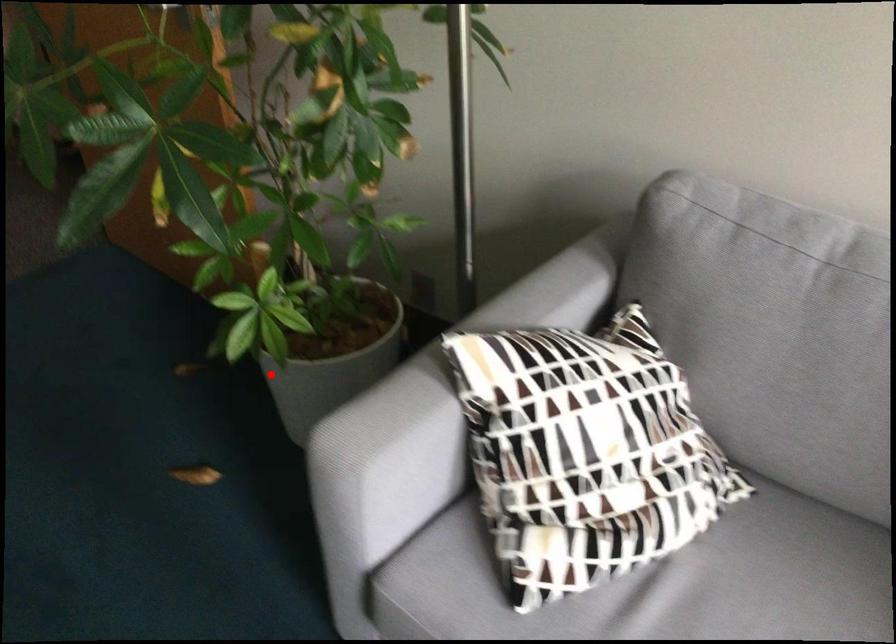
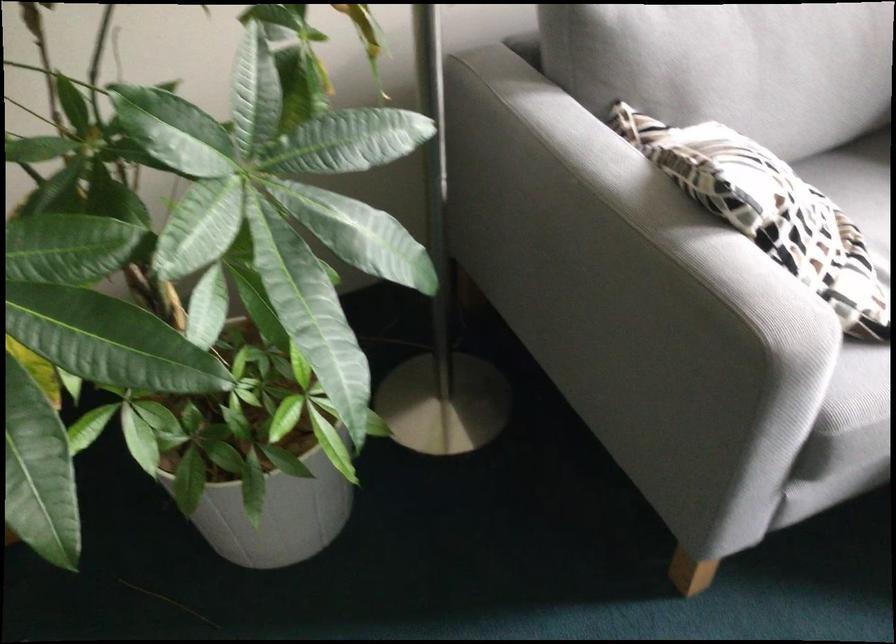
Locate, in the second image, the point that corresponds to the highlighted location in the first image.

(273, 506)